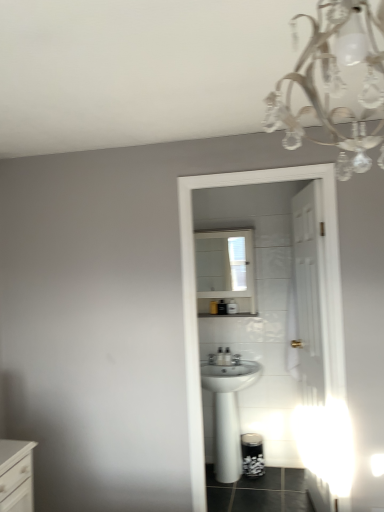
Question: Does white glossy chest of drawers at lower left have a smaller size compared to white glossy sink at center?

Choices:
 (A) yes
 (B) no

Answer: (A)

Question: Does white glossy chest of drawers at lower left have a lesser width compared to white glossy sink at center?

Choices:
 (A) yes
 (B) no

Answer: (A)

Question: From the image's perspective, is white glossy chest of drawers at lower left on top of white glossy sink at center?

Choices:
 (A) yes
 (B) no

Answer: (A)

Question: Considering the relative sizes of white glossy chest of drawers at lower left and white glossy sink at center in the image provided, is white glossy chest of drawers at lower left bigger than white glossy sink at center?

Choices:
 (A) yes
 (B) no

Answer: (B)

Question: From the image's perspective, does white glossy chest of drawers at lower left appear lower than white glossy sink at center?

Choices:
 (A) no
 (B) yes

Answer: (A)

Question: Can you confirm if white glossy chest of drawers at lower left is positioned to the left of white glossy sink at center?

Choices:
 (A) no
 (B) yes

Answer: (B)

Question: Is white glossy sink at center turned away from clear crystal chandelier at upper right?

Choices:
 (A) yes
 (B) no

Answer: (B)

Question: Does white glossy sink at center have a greater height compared to clear crystal chandelier at upper right?

Choices:
 (A) no
 (B) yes

Answer: (B)

Question: From the image's perspective, is white glossy sink at center on clear crystal chandelier at upper right?

Choices:
 (A) yes
 (B) no

Answer: (B)

Question: Considering the relative sizes of white glossy sink at center and clear crystal chandelier at upper right in the image provided, is white glossy sink at center thinner than clear crystal chandelier at upper right?

Choices:
 (A) no
 (B) yes

Answer: (A)

Question: From a real-world perspective, is white glossy sink at center over clear crystal chandelier at upper right?

Choices:
 (A) no
 (B) yes

Answer: (A)

Question: Considering the relative sizes of white glossy sink at center and clear crystal chandelier at upper right in the image provided, is white glossy sink at center wider than clear crystal chandelier at upper right?

Choices:
 (A) yes
 (B) no

Answer: (A)

Question: Is white glossy medicine cabinet at center further to the viewer compared to white glossy sink at center?

Choices:
 (A) no
 (B) yes

Answer: (B)